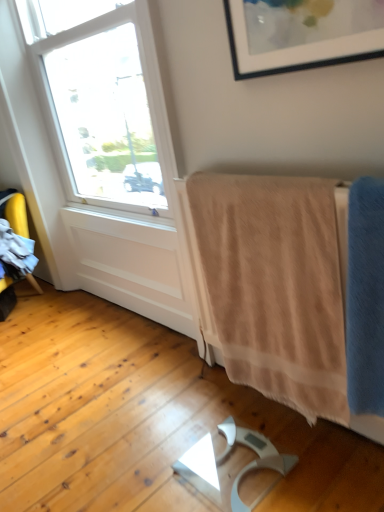
Question: Does beige soft towel at lower right, which is the first bath towel from back to front, come in front of blue soft towel at right, acting as the second bath towel starting from the back?

Choices:
 (A) no
 (B) yes

Answer: (A)

Question: Is beige soft towel at lower right, the second bath towel when ordered from front to back, next to blue soft towel at right, arranged as the 1th bath towel when viewed from the front?

Choices:
 (A) yes
 (B) no

Answer: (B)

Question: Can you confirm if beige soft towel at lower right, which is the first bath towel from back to front, is thinner than blue soft towel at right, acting as the second bath towel starting from the back?

Choices:
 (A) yes
 (B) no

Answer: (A)

Question: From a real-world perspective, is beige soft towel at lower right, the second bath towel when ordered from front to back, positioned over blue soft towel at right, acting as the second bath towel starting from the back, based on gravity?

Choices:
 (A) no
 (B) yes

Answer: (A)

Question: From a real-world perspective, is beige soft towel at lower right, which is the first bath towel from back to front, under blue soft towel at right, acting as the second bath towel starting from the back?

Choices:
 (A) yes
 (B) no

Answer: (A)

Question: Does beige soft towel at lower right, which is the first bath towel from back to front, turn towards blue soft towel at right, arranged as the 1th bath towel when viewed from the front?

Choices:
 (A) no
 (B) yes

Answer: (A)

Question: From a real-world perspective, is blue soft towel at right, arranged as the 1th bath towel when viewed from the front, located beneath beige soft towel at lower right, the second bath towel when ordered from front to back?

Choices:
 (A) no
 (B) yes

Answer: (A)

Question: Can you confirm if blue soft towel at right, arranged as the 1th bath towel when viewed from the front, is thinner than beige soft towel at lower right, the second bath towel when ordered from front to back?

Choices:
 (A) yes
 (B) no

Answer: (B)

Question: From the image's perspective, does blue soft towel at right, arranged as the 1th bath towel when viewed from the front, appear higher than beige soft towel at lower right, which is the first bath towel from back to front?

Choices:
 (A) no
 (B) yes

Answer: (A)

Question: Considering the relative sizes of blue soft towel at right, acting as the second bath towel starting from the back, and beige soft towel at lower right, the second bath towel when ordered from front to back, in the image provided, is blue soft towel at right, acting as the second bath towel starting from the back, bigger than beige soft towel at lower right, the second bath towel when ordered from front to back,?

Choices:
 (A) yes
 (B) no

Answer: (B)

Question: Does blue soft towel at right, arranged as the 1th bath towel when viewed from the front, have a smaller size compared to beige soft towel at lower right, the second bath towel when ordered from front to back?

Choices:
 (A) yes
 (B) no

Answer: (A)

Question: Would you say blue soft towel at right, arranged as the 1th bath towel when viewed from the front, is a long distance from beige soft towel at lower right, which is the first bath towel from back to front?

Choices:
 (A) yes
 (B) no

Answer: (B)

Question: Does point (377, 244) appear closer or farther from the camera than point (332, 230)?

Choices:
 (A) farther
 (B) closer

Answer: (B)